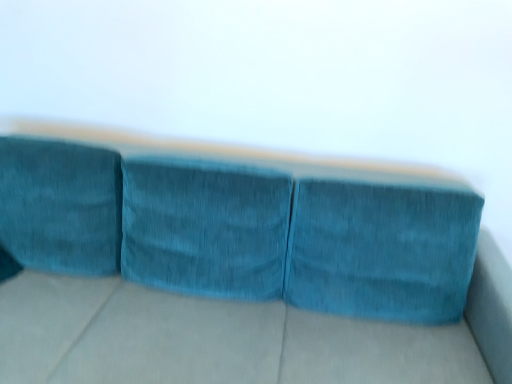
The width and height of the screenshot is (512, 384). What do you see at coordinates (205, 338) in the screenshot?
I see `velvet teal couch at center` at bounding box center [205, 338].

Measure the distance between velvet teal couch at center and camera.

1.21 meters.

Measure the distance between point (211,351) and camera.

A distance of 4.49 feet exists between point (211,351) and camera.

The image size is (512, 384). What are the coordinates of `velvet teal couch at center` in the screenshot? It's located at (205, 338).

You are a GUI agent. You are given a task and a screenshot of the screen. Output one action in this format:
    pyautogui.click(x=<x>, y=<y>)
    Task: Click on the velvet teal couch at center
    
    Given the screenshot: What is the action you would take?
    pyautogui.click(x=205, y=338)